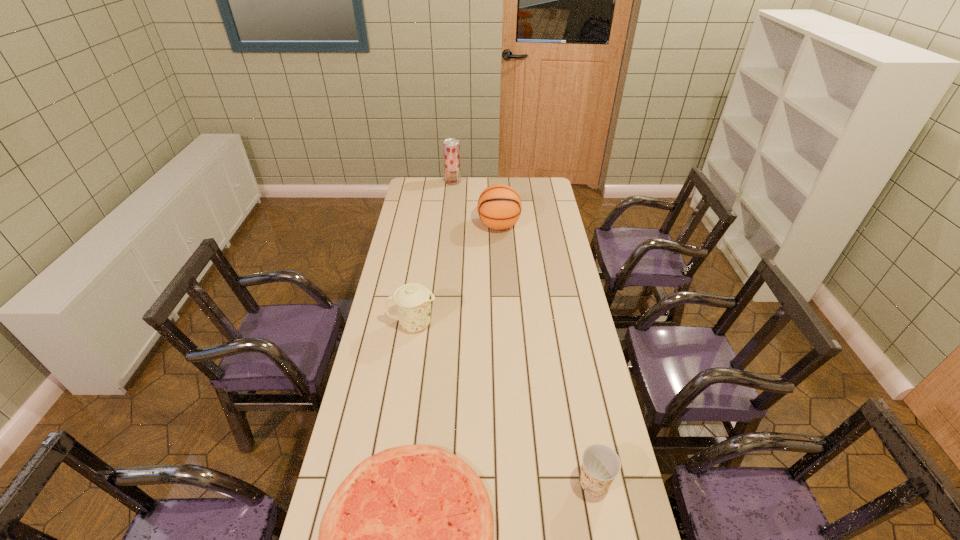
The height and width of the screenshot is (540, 960). I want to click on object that is at the far edge, so click(x=451, y=147).

At what (x,y) coordinates should I click in order to perform the action: click on object present at the left edge. Please return your answer as a coordinate pair (x, y). Image resolution: width=960 pixels, height=540 pixels. Looking at the image, I should click on (413, 300).

I want to click on object located at the right edge, so [601, 465].

This screenshot has width=960, height=540. Find the location of `free region at the left edge`. free region at the left edge is located at coordinates (400, 282).

The height and width of the screenshot is (540, 960). What are the coordinates of `free space at the right edge of the desktop` in the screenshot? It's located at (559, 244).

At what (x,y) coordinates should I click in order to perform the action: click on vacant point located between the basketball and the second shortest object. Please return your answer as a coordinate pair (x, y). The width and height of the screenshot is (960, 540). Looking at the image, I should click on (546, 354).

At what (x,y) coordinates should I click in order to perform the action: click on unoccupied area between the fruit juice and the rightmost object. Please return your answer as a coordinate pair (x, y). This screenshot has width=960, height=540. Looking at the image, I should click on (523, 332).

The height and width of the screenshot is (540, 960). What are the coordinates of `free point between the farthest object and the basketball` in the screenshot? It's located at (476, 204).

Where is `free spot between the third farthest object and the fruit juice`? This screenshot has height=540, width=960. free spot between the third farthest object and the fruit juice is located at coordinates (433, 253).

Where is `free point between the fruit juice and the basketball`? Image resolution: width=960 pixels, height=540 pixels. free point between the fruit juice and the basketball is located at coordinates (476, 204).